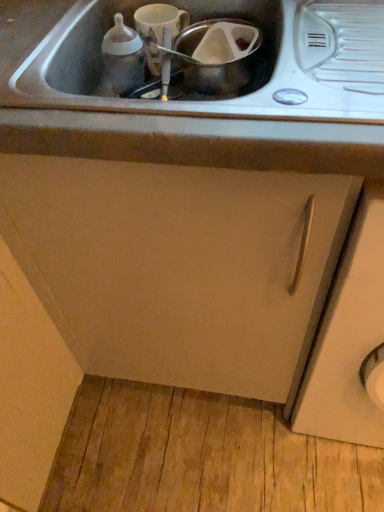
Question: Is matte white cup at upper center, the first appliance when ordered from left to right, positioned with its back to metallic stainless steel sink at center, the second sink positioned from the front?

Choices:
 (A) yes
 (B) no

Answer: (B)

Question: Can you confirm if matte white cup at upper center, the first appliance when ordered from left to right, is thinner than metallic stainless steel sink at center, the second sink positioned from the front?

Choices:
 (A) yes
 (B) no

Answer: (A)

Question: Can you confirm if matte white cup at upper center, the first appliance when ordered from left to right, is smaller than metallic stainless steel sink at center, the first sink when ordered from back to front?

Choices:
 (A) no
 (B) yes

Answer: (B)

Question: Is matte white cup at upper center, marked as the second appliance in a right-to-left arrangement, beside metallic stainless steel sink at center, the second sink positioned from the front?

Choices:
 (A) yes
 (B) no

Answer: (A)

Question: From a real-world perspective, is matte white cup at upper center, the first appliance when ordered from left to right, located beneath metallic stainless steel sink at center, the second sink positioned from the front?

Choices:
 (A) no
 (B) yes

Answer: (A)

Question: From their relative heights in the image, would you say matte white cup at upper center, the first appliance when ordered from left to right, is taller or shorter than stainless steel sink at upper center, which ranks as the second sink in back-to-front order?

Choices:
 (A) tall
 (B) short

Answer: (B)

Question: In terms of size, does matte white cup at upper center, marked as the second appliance in a right-to-left arrangement, appear bigger or smaller than stainless steel sink at upper center, which ranks as the second sink in back-to-front order?

Choices:
 (A) big
 (B) small

Answer: (B)

Question: Considering their positions, is matte white cup at upper center, marked as the second appliance in a right-to-left arrangement, located in front of or behind stainless steel sink at upper center, which ranks as the second sink in back-to-front order?

Choices:
 (A) behind
 (B) front

Answer: (A)

Question: Is matte white cup at upper center, the first appliance when ordered from left to right, spatially inside stainless steel sink at upper center, the 1th sink viewed from the front, or outside of it?

Choices:
 (A) inside
 (B) outside

Answer: (A)

Question: Is white matte cabinet door at center-right, the 2th cabinetry when ordered from left to right, inside the boundaries of stainless steel sink at upper center, the 1th sink viewed from the front, or outside?

Choices:
 (A) inside
 (B) outside

Answer: (B)

Question: In the image, is white matte cabinet door at center-right, the 1th cabinetry positioned from the right, positioned in front of or behind stainless steel sink at upper center, the 1th sink viewed from the front?

Choices:
 (A) front
 (B) behind

Answer: (A)

Question: Based on their sizes in the image, would you say white matte cabinet door at center-right, the 2th cabinetry when ordered from left to right, is bigger or smaller than stainless steel sink at upper center, the 1th sink viewed from the front?

Choices:
 (A) small
 (B) big

Answer: (B)

Question: In terms of width, does white matte cabinet door at center-right, the 2th cabinetry when ordered from left to right, look wider or thinner when compared to stainless steel sink at upper center, which ranks as the second sink in back-to-front order?

Choices:
 (A) wide
 (B) thin

Answer: (A)

Question: From the image's perspective, is white matte cabinet door at center-right, the 1th cabinetry positioned from the right, positioned above or below metallic stainless steel sink at center, the second sink positioned from the front?

Choices:
 (A) below
 (B) above

Answer: (A)

Question: In terms of width, does white matte cabinet door at center-right, the 2th cabinetry when ordered from left to right, look wider or thinner when compared to metallic stainless steel sink at center, the first sink when ordered from back to front?

Choices:
 (A) thin
 (B) wide

Answer: (B)